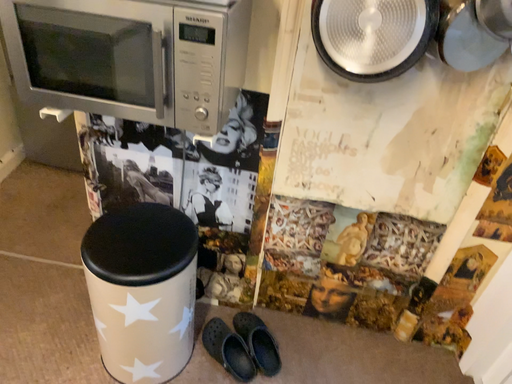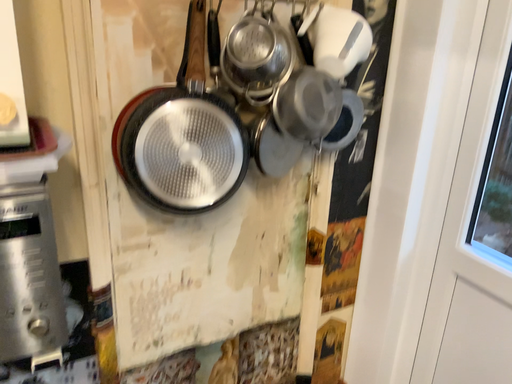
Question: How did the camera likely rotate when shooting the video?

Choices:
 (A) rotated left
 (B) rotated right

Answer: (B)